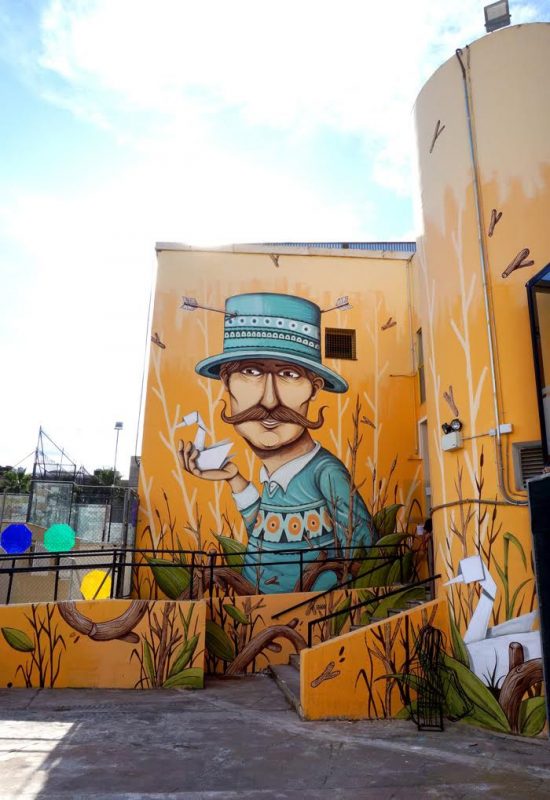
Locate an element on the screen. Image resolution: width=550 pixels, height=800 pixels. floor is located at coordinates (299, 753).